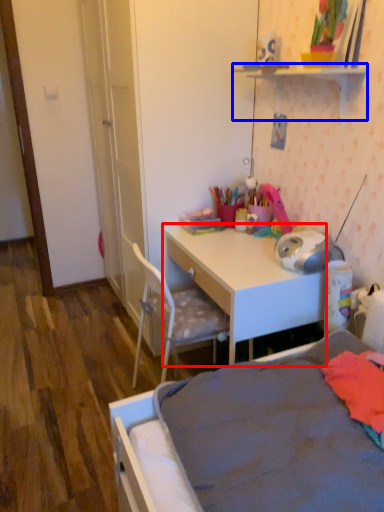
Question: Which point is further to the camera, desk (highlighted by a red box) or shelf (highlighted by a blue box)?

Choices:
 (A) desk
 (B) shelf

Answer: (A)